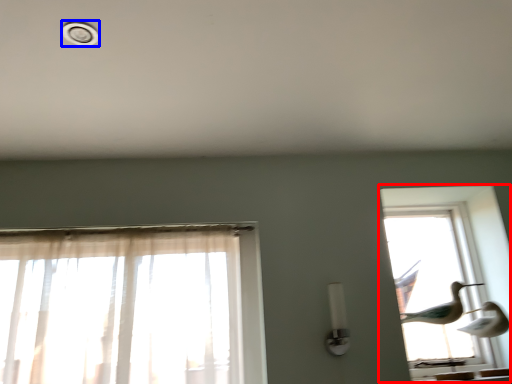
Question: Which object appears closest to the camera in this image, window (highlighted by a red box) or dot (highlighted by a blue box)?

Choices:
 (A) window
 (B) dot

Answer: (B)